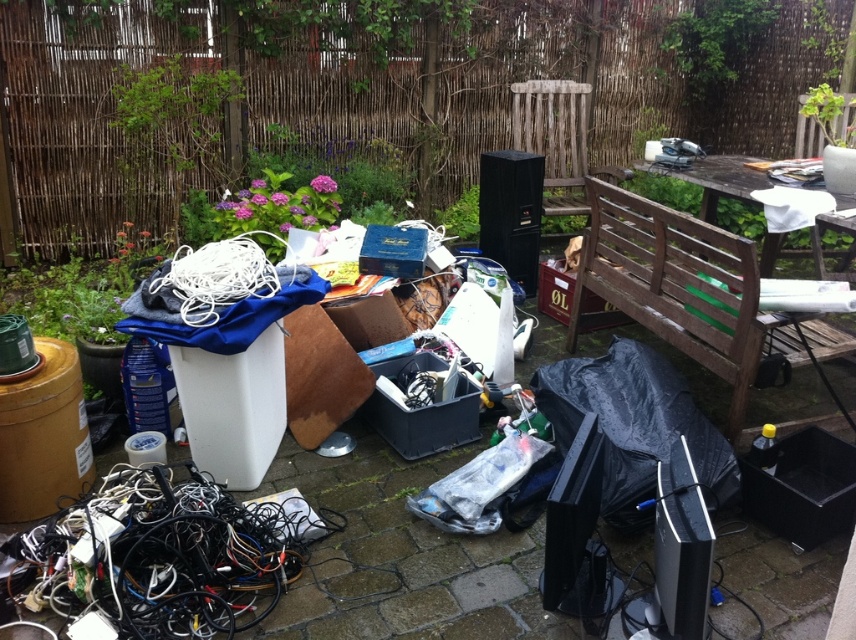
You are trying to determine if the black rubber wires at lower left can be placed on top of the wooden bench at upper right. Based on their sizes, is this possible?

The black rubber wires at lower left are not as tall as the wooden bench at upper right, so they can be placed on top of it since their height does not exceed the bench.